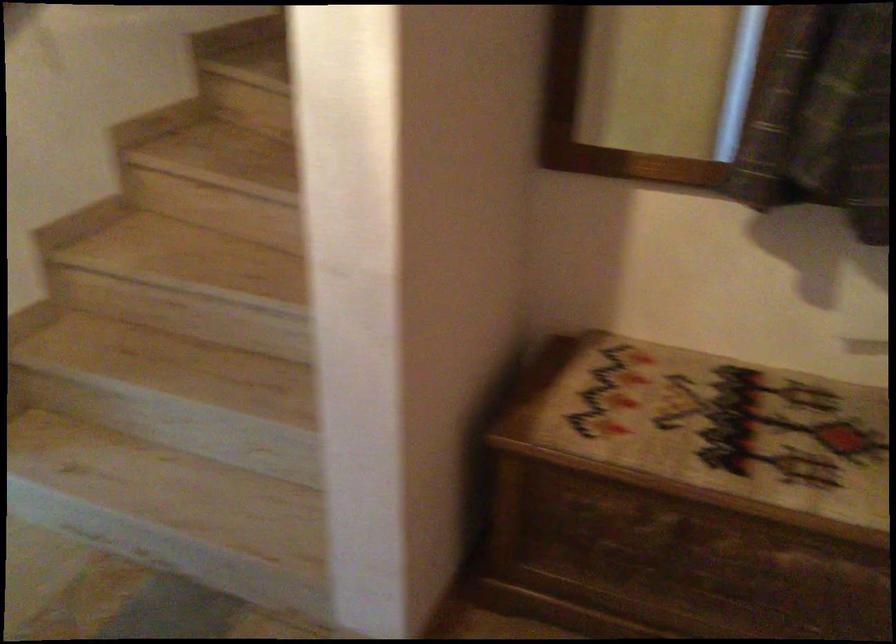
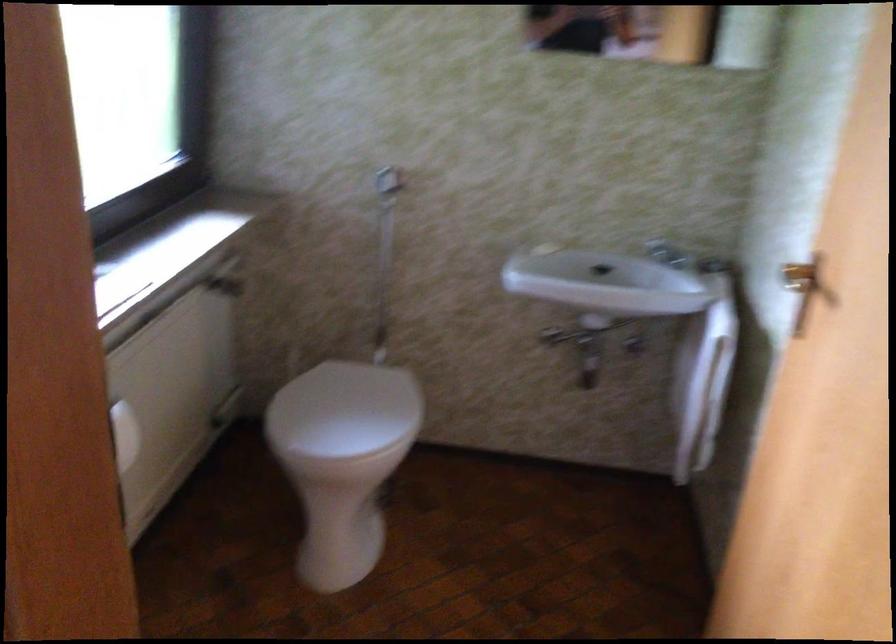
Which direction would the cameraman need to move to produce the second image?

The movement direction of the cameraman is left, forward.